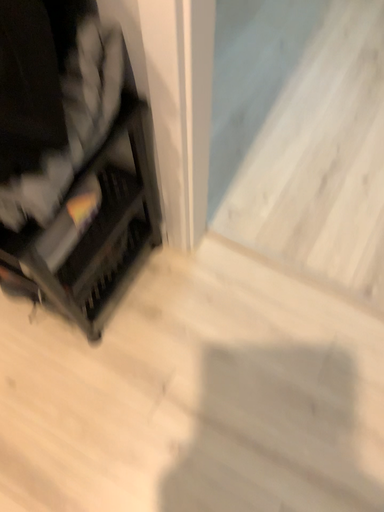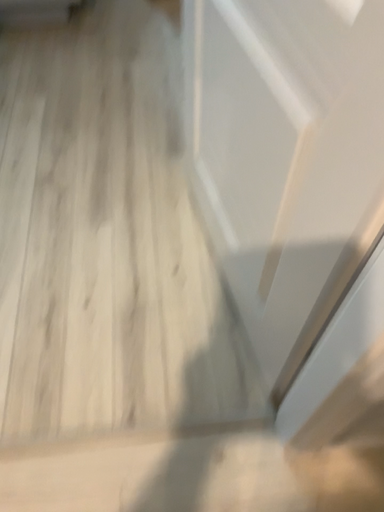
Question: How did the camera likely rotate when shooting the video?

Choices:
 (A) rotated left
 (B) rotated right

Answer: (B)